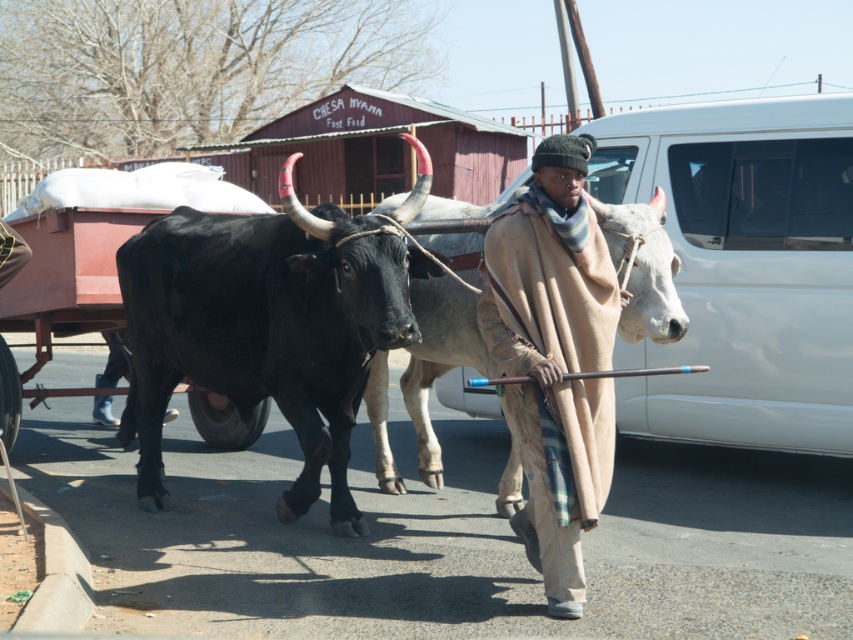
Question: Does shiny black bull at center appear over beige woolen blanket at center?

Choices:
 (A) no
 (B) yes

Answer: (B)

Question: Which object appears closest to the camera in this image?

Choices:
 (A) beige woolen blanket at center
 (B) shiny black bull at center

Answer: (A)

Question: Is shiny black bull at center to the left of beige woolen blanket at center from the viewer's perspective?

Choices:
 (A) no
 (B) yes

Answer: (B)

Question: Does shiny black bull at center have a greater width compared to beige woolen blanket at center?

Choices:
 (A) yes
 (B) no

Answer: (A)

Question: Which point is closer to the camera?

Choices:
 (A) (296, 406)
 (B) (525, 276)

Answer: (B)